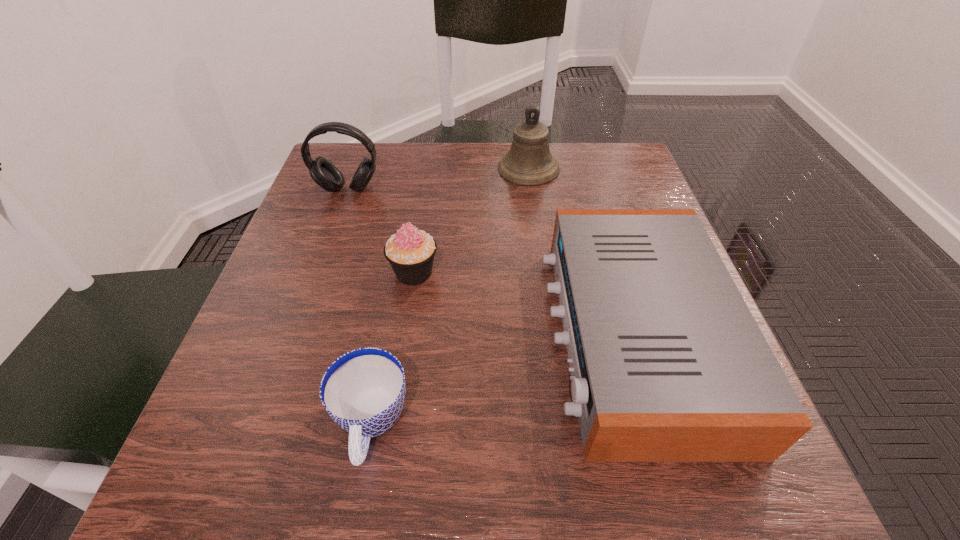
Locate an element on the screen. This screenshot has width=960, height=540. bell is located at coordinates (528, 162).

You are a GUI agent. You are given a task and a screenshot of the screen. Output one action in this format:
    pyautogui.click(x=<x>, y=<y>)
    Task: Click on the headset
    Image resolution: width=960 pixels, height=540 pixels.
    Given the screenshot: What is the action you would take?
    pyautogui.click(x=323, y=172)

Find the location of a particular element. Image resolution: width=960 pixels, height=540 pixels. cupcake is located at coordinates (410, 252).

Where is `the fourth tallest object`? The width and height of the screenshot is (960, 540). the fourth tallest object is located at coordinates (668, 364).

Locate an element on the screen. The width and height of the screenshot is (960, 540). the shortest object is located at coordinates click(x=363, y=391).

Locate an element on the screen. Image resolution: width=960 pixels, height=540 pixels. free region located on the front of the bell is located at coordinates (533, 201).

Identify the location of free spot located on the earcups of the headset. (294, 341).

The height and width of the screenshot is (540, 960). I want to click on free region located on the left of the cupcake, so click(x=346, y=272).

Identify the location of vacant space located 0.150m on the control panel of the radio receiver. (460, 335).

Locate an element on the screen. This screenshot has width=960, height=540. free space located 0.230m on the control panel of the radio receiver is located at coordinates (410, 335).